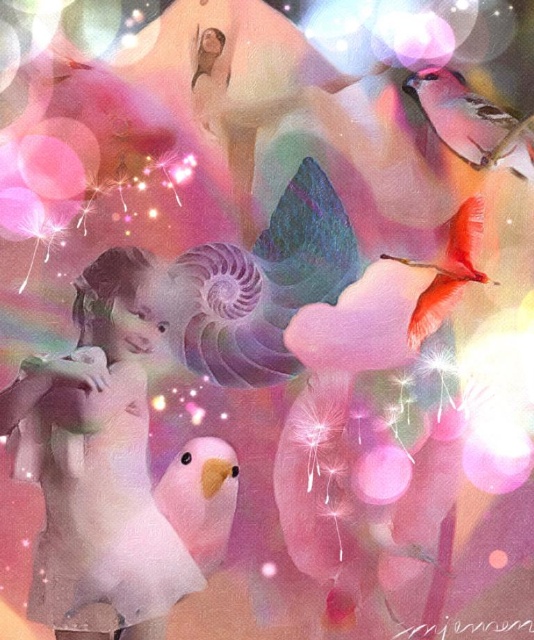
Is pink matte bird at lower left in front of matte pink flamingo at upper right?

Yes.

Between pink matte bird at lower left and matte pink flamingo at upper right, which one is positioned lower?

pink matte bird at lower left is lower down.

This screenshot has height=640, width=534. In order to click on pink matte bird at lower left in this screenshot , I will do `click(200, 500)`.

Who is positioned more to the left, matte pink parrot at upper right or matte pink flamingo at upper right?

matte pink flamingo at upper right is more to the left.

Which is in front, point (411, 96) or point (443, 266)?

Point (411, 96) is more forward.

Between point (453, 88) and point (442, 266), which one is positioned in front?

Point (453, 88) is more forward.

You are a GUI agent. You are given a task and a screenshot of the screen. Output one action in this format:
    pyautogui.click(x=<x>, y=<y>)
    Task: Click on the matte pink parrot at upper right
    The height and width of the screenshot is (640, 534).
    Given the screenshot: What is the action you would take?
    pyautogui.click(x=472, y=122)

How distant is pink matte bird at lower left from matte pink parrot at upper right?

The distance of pink matte bird at lower left from matte pink parrot at upper right is 25.98 inches.

Is pink matte bird at lower left shorter than matte pink parrot at upper right?

Incorrect, pink matte bird at lower left's height does not fall short of matte pink parrot at upper right's.

Does point (178, 488) come behind point (438, 113)?

That is False.

Locate an element on the screen. The width and height of the screenshot is (534, 640). pink matte bird at lower left is located at coordinates (200, 500).